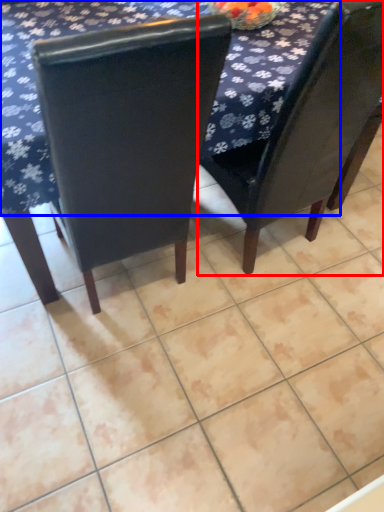
Question: Which object is further to the camera taking this photo, chair (highlighted by a red box) or tablecloth (highlighted by a blue box)?

Choices:
 (A) chair
 (B) tablecloth

Answer: (B)